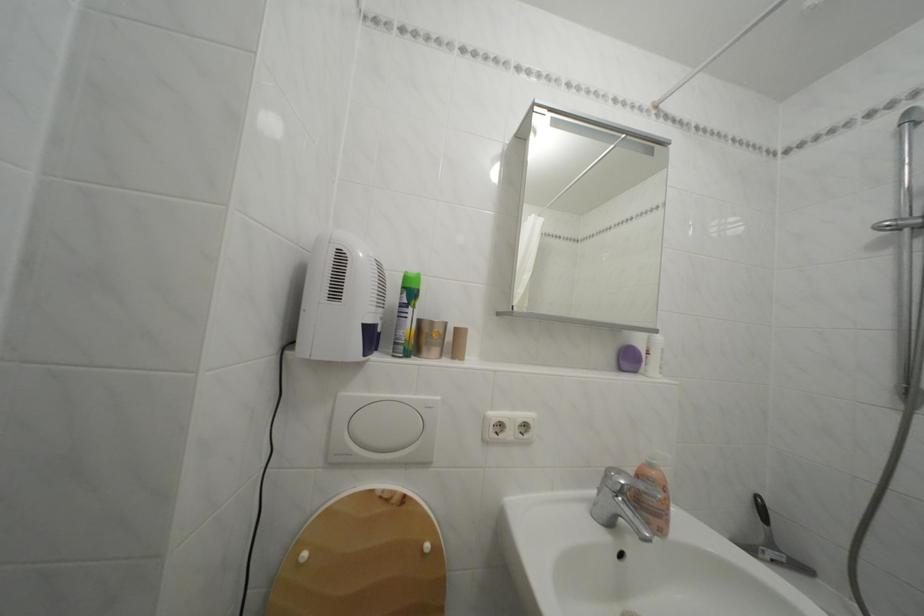
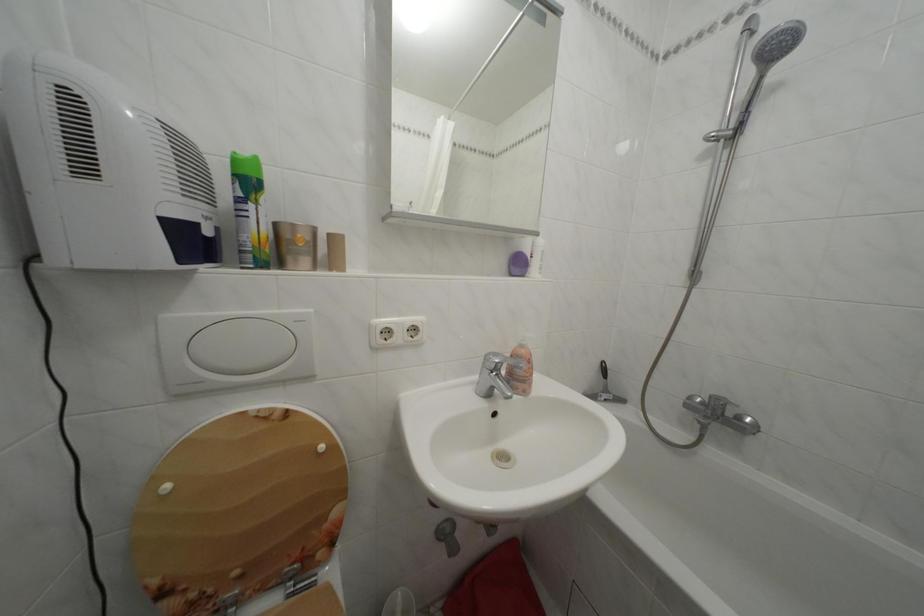
Question: Which direction would the cameraman need to move to produce the second image? Reply with the corresponding letter.

Choices:
 (A) Left
 (B) Right
 (C) Forward
 (D) Backward

Answer: (B)